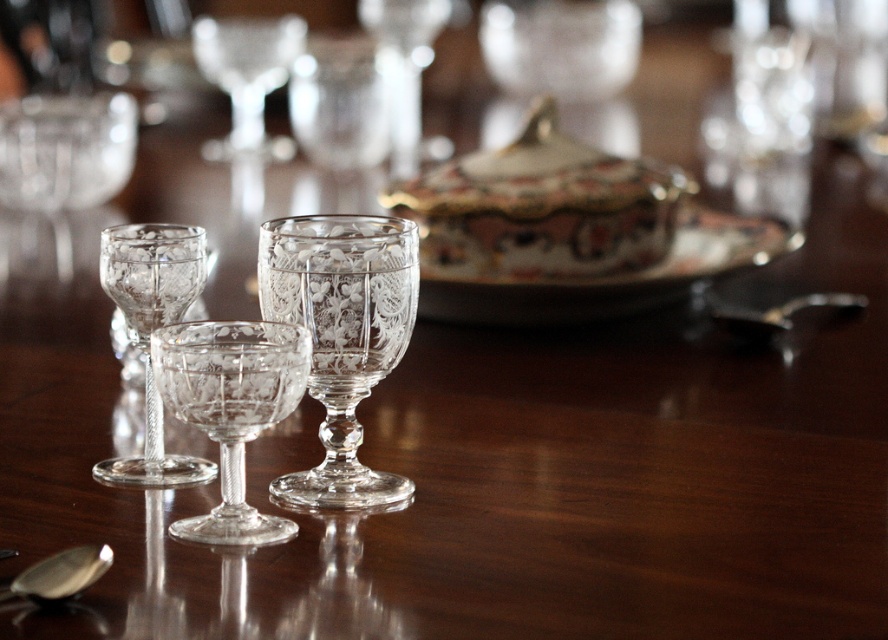
Is clear crystal wine glass at left smaller than silver metallic spoon at lower left?

No, clear crystal wine glass at left is not smaller than silver metallic spoon at lower left.

What are the coordinates of `clear crystal wine glass at left` in the screenshot? It's located at (149, 332).

Where is `clear crystal wine glass at left`? The width and height of the screenshot is (888, 640). clear crystal wine glass at left is located at coordinates (149, 332).

Who is more forward, (244,38) or (42,596)?

Point (42,596)

You are a GUI agent. You are given a task and a screenshot of the screen. Output one action in this format:
    pyautogui.click(x=<x>, y=<y>)
    Task: Click on the clear crystal wine glass at center
    
    Given the screenshot: What is the action you would take?
    pyautogui.click(x=247, y=77)

Between point (213, 56) and point (66, 580), which one is positioned behind?

Point (213, 56)

At what (x,y) coordinates should I click in order to perform the action: click on clear crystal wine glass at center. Please return your answer as a coordinate pair (x, y). Image resolution: width=888 pixels, height=640 pixels. Looking at the image, I should click on (247, 77).

Is transparent crystal wine glass at center above polished silver spoon at lower right?

No, transparent crystal wine glass at center is not above polished silver spoon at lower right.

Can you confirm if transparent crystal wine glass at center is bigger than polished silver spoon at lower right?

Actually, transparent crystal wine glass at center might be smaller than polished silver spoon at lower right.

Describe the element at coordinates (231, 408) in the screenshot. The height and width of the screenshot is (640, 888). I see `transparent crystal wine glass at center` at that location.

You are a GUI agent. You are given a task and a screenshot of the screen. Output one action in this format:
    pyautogui.click(x=<x>, y=<y>)
    Task: Click on the transparent crystal wine glass at center
    The image size is (888, 640).
    Given the screenshot: What is the action you would take?
    pyautogui.click(x=231, y=408)